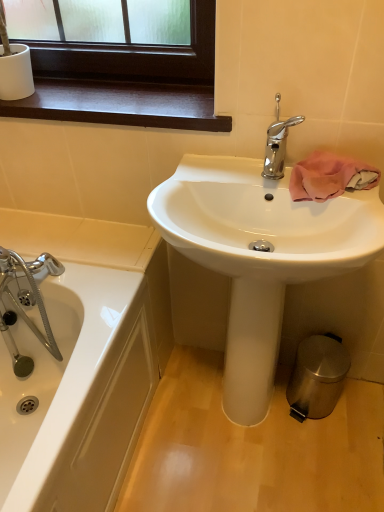
Question: From a real-world perspective, is dark wood window sill at upper left over white glossy sink at center?

Choices:
 (A) yes
 (B) no

Answer: (A)

Question: Would you say white glossy sink at center is part of dark wood window sill at upper left's contents?

Choices:
 (A) yes
 (B) no

Answer: (B)

Question: From a real-world perspective, is dark wood window sill at upper left located beneath white glossy sink at center?

Choices:
 (A) yes
 (B) no

Answer: (B)

Question: Is dark wood window sill at upper left behind white glossy sink at center?

Choices:
 (A) yes
 (B) no

Answer: (A)

Question: From the image's perspective, is dark wood window sill at upper left above white glossy sink at center?

Choices:
 (A) yes
 (B) no

Answer: (A)

Question: Is dark wood window sill at upper left to the left of white glossy sink at center from the viewer's perspective?

Choices:
 (A) yes
 (B) no

Answer: (A)

Question: From a real-world perspective, is polished chrome faucet at upper center positioned over white glossy sink at center based on gravity?

Choices:
 (A) yes
 (B) no

Answer: (A)

Question: Can you confirm if polished chrome faucet at upper center is shorter than white glossy sink at center?

Choices:
 (A) yes
 (B) no

Answer: (A)

Question: Is polished chrome faucet at upper center facing towards white glossy sink at center?

Choices:
 (A) yes
 (B) no

Answer: (B)

Question: Does polished chrome faucet at upper center have a smaller size compared to white glossy sink at center?

Choices:
 (A) yes
 (B) no

Answer: (A)

Question: Is there a large distance between polished chrome faucet at upper center and white glossy sink at center?

Choices:
 (A) yes
 (B) no

Answer: (B)

Question: From the image's perspective, is polished chrome faucet at upper center over white glossy sink at center?

Choices:
 (A) yes
 (B) no

Answer: (A)

Question: Is polished chrome faucet at upper center far from polished stainless steel trash can at lower right?

Choices:
 (A) yes
 (B) no

Answer: (B)